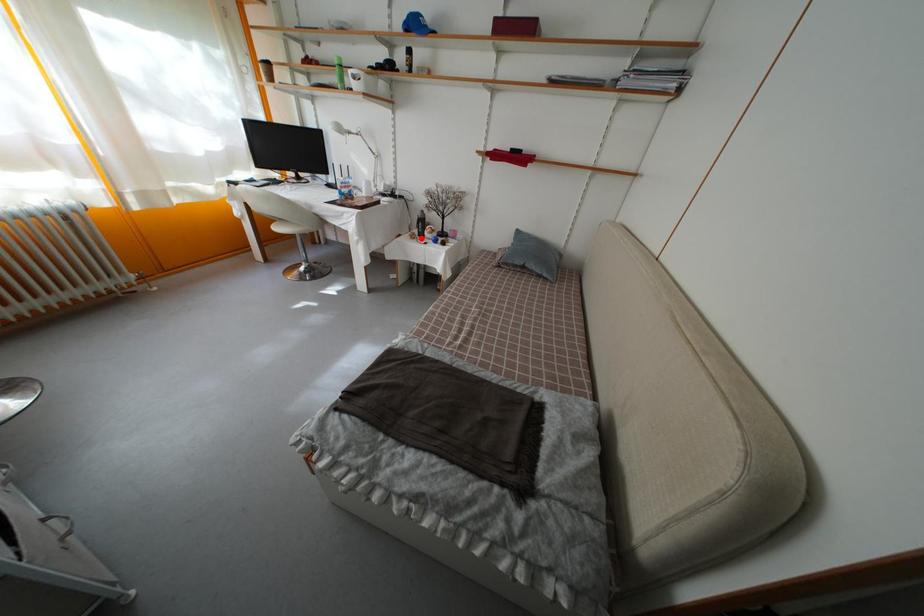
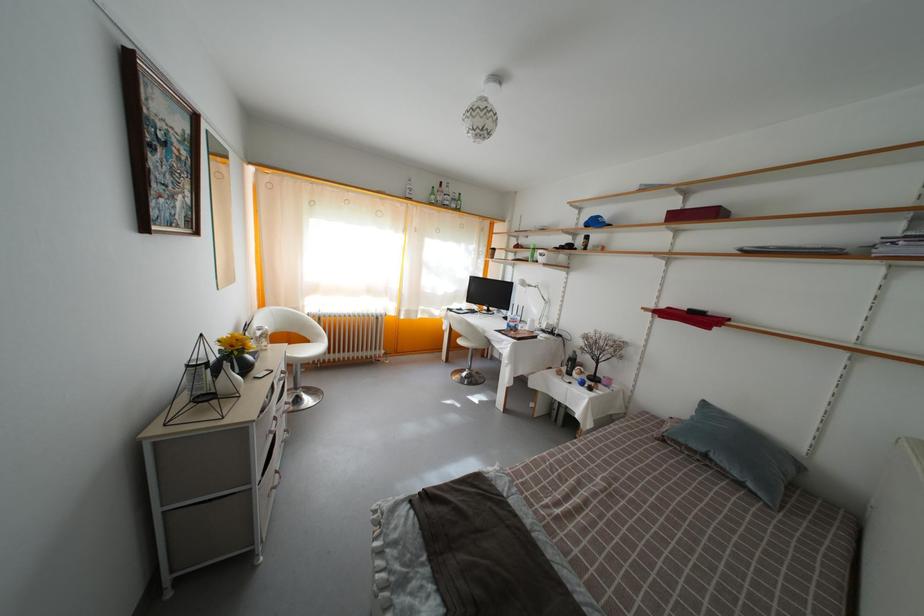
Question: I am providing you with two images of the same scene from different viewpoints. A red point is marked on the first image. Can you still see the location of the red point in image 2?

Choices:
 (A) Yes
 (B) No

Answer: (A)